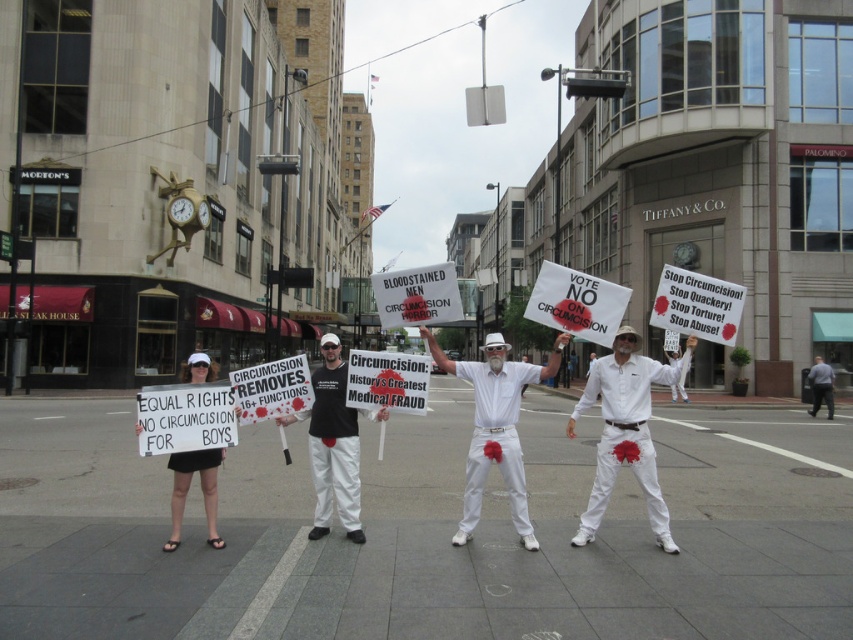
Question: Which of the following is the closest to the observer?

Choices:
 (A) (219, 545)
 (B) (405, 355)
 (C) (343, 452)
 (D) (831, 403)

Answer: (A)

Question: Is white cotton shirt at center wider than black cotton t-shirt at center?

Choices:
 (A) no
 (B) yes

Answer: (B)

Question: Can you confirm if white cotton shirt at center is positioned below gray fabric pants at lower right?

Choices:
 (A) yes
 (B) no

Answer: (B)

Question: Which of the following is the closest to the observer?

Choices:
 (A) gray fabric pants at lower right
 (B) white cotton pants at center
 (C) white cotton shirt at center

Answer: (C)

Question: Can you confirm if white cotton pants at center is positioned above gray fabric pants at lower right?

Choices:
 (A) no
 (B) yes

Answer: (B)

Question: Which point is farther from the camera taking this photo?

Choices:
 (A) (135, 429)
 (B) (807, 374)
 (C) (407, 374)
 (D) (329, 348)

Answer: (B)